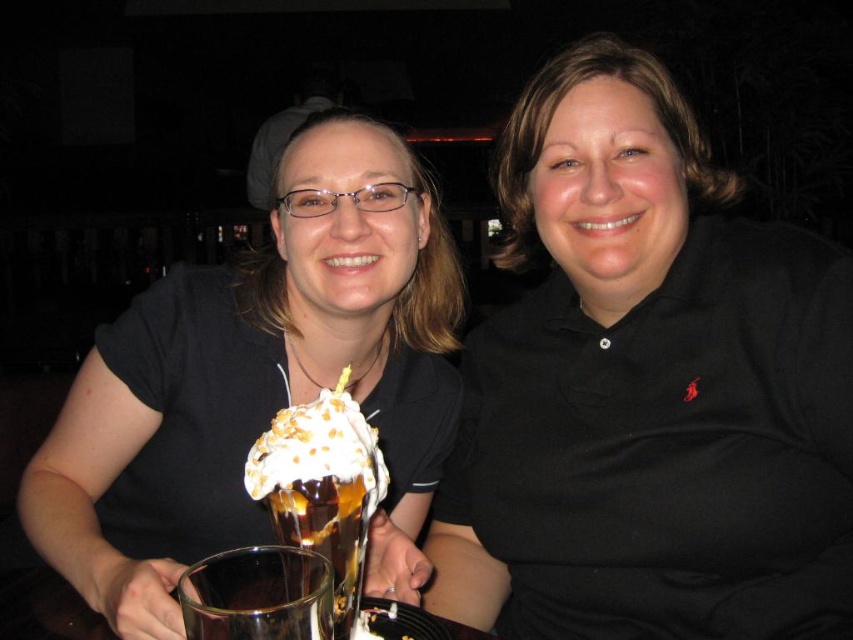
Who is shorter, whipped cream topped sundae at center or transparent glass at lower center?

transparent glass at lower center

Is point (332, 518) closer to camera compared to point (210, 634)?

That is False.

At what (x,y) coordinates should I click in order to perform the action: click on whipped cream topped sundae at center. Please return your answer as a coordinate pair (x, y). This screenshot has height=640, width=853. Looking at the image, I should click on (322, 486).

Which is more to the left, matte black shirt at center or whipped cream topped sundae at center?

From the viewer's perspective, matte black shirt at center appears more on the left side.

Can you confirm if matte black shirt at center is smaller than whipped cream topped sundae at center?

Actually, matte black shirt at center might be larger than whipped cream topped sundae at center.

Does point (276, 362) lie behind point (294, 540)?

Yes.

At what (x,y) coordinates should I click in order to perform the action: click on matte black shirt at center. Please return your answer as a coordinate pair (x, y). This screenshot has height=640, width=853. Looking at the image, I should click on (258, 381).

Is black matte shirt at center bigger than translucent glass cup at center?

Yes, black matte shirt at center is bigger than translucent glass cup at center.

Between point (544, 506) and point (285, 538), which one is positioned in front?

Point (285, 538) is in front.

Is point (726, 381) behind point (328, 518)?

Yes.

Locate an element on the screen. black matte shirt at center is located at coordinates (647, 392).